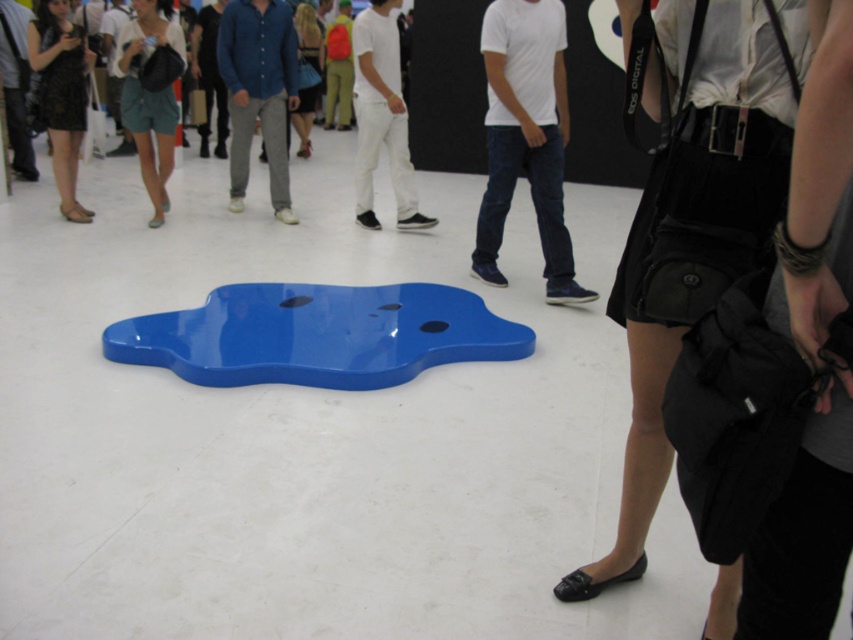
You are a photographer at the exhibition and want to capture both the white matte pants at center and the matte black dress at left in a single frame. Given their sizes, which one should you focus on to ensure both fit in the photo without cropping?

Since the white matte pants at center is wider than the matte black dress at left, you should focus on the white matte pants at center to ensure both fit in the photo without cropping.